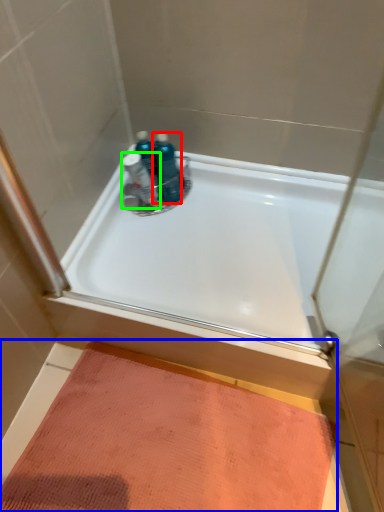
Question: Which is farther away from toiletry (highlighted by a red box)? doormat (highlighted by a blue box) or toiletry (highlighted by a green box)?

Choices:
 (A) doormat
 (B) toiletry

Answer: (A)